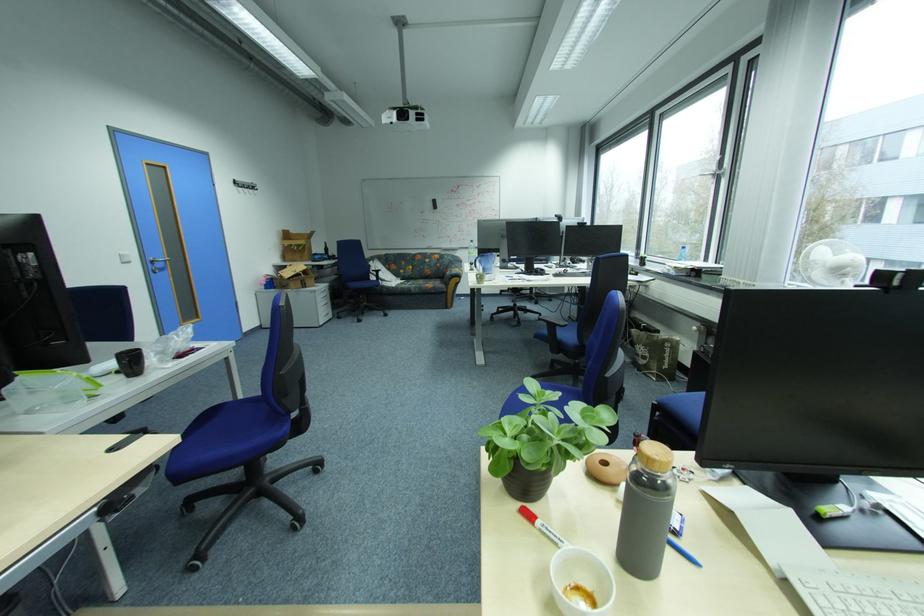
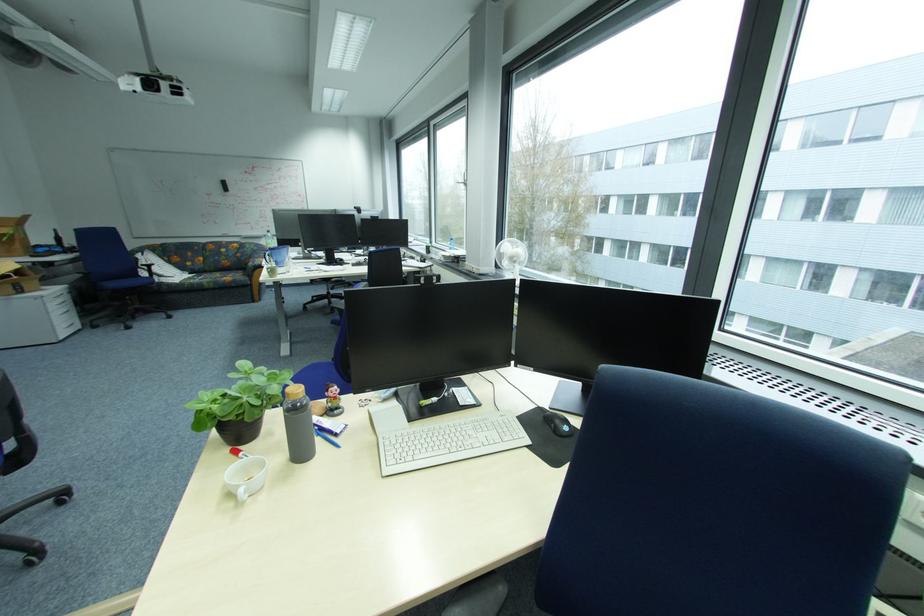
The point at (362, 286) is marked in the first image. Where is the corresponding point in the second image?

(120, 286)